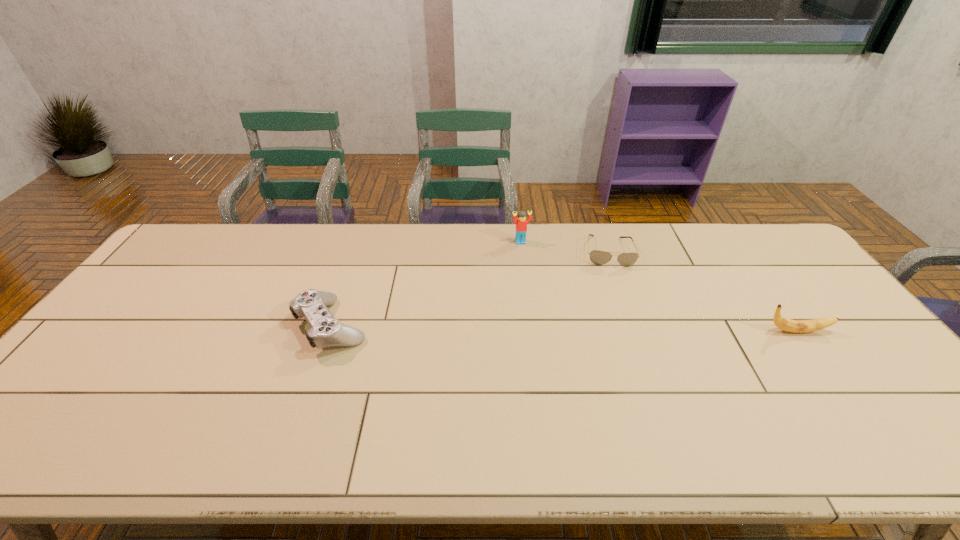
Identify the location of the leftmost object. This screenshot has height=540, width=960. [x=326, y=330].

I want to click on control, so pyautogui.click(x=326, y=330).

You are a GUI agent. You are given a task and a screenshot of the screen. Output one action in this format:
    pyautogui.click(x=<x>, y=<y>)
    Task: Click on the banana
    The image size is (960, 540).
    Given the screenshot: What is the action you would take?
    (x=796, y=326)

The height and width of the screenshot is (540, 960). I want to click on the rightmost object, so click(796, 326).

Where is `the third object from right to left`? the third object from right to left is located at coordinates (521, 223).

At what (x,y) coordinates should I click in order to perform the action: click on the tallest object. Please return your answer as a coordinate pair (x, y). Looking at the image, I should click on (521, 223).

Identify the location of the shortest object. (597, 257).

At what (x,y) coordinates should I click in order to perform the action: click on the second object from right to left. Please return your answer as a coordinate pair (x, y). The image size is (960, 540). Looking at the image, I should click on (597, 257).

Where is `free space located on the back of the leftmost object`? free space located on the back of the leftmost object is located at coordinates (357, 251).

Identify the location of vacant space located on the peel of the second tallest object from the top. The width and height of the screenshot is (960, 540). (852, 331).